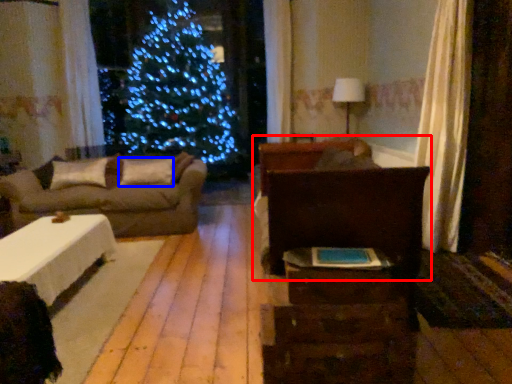
Question: Which of the following is the closest to the observer, bed (highlighted by a red box) or pillow (highlighted by a blue box)?

Choices:
 (A) bed
 (B) pillow

Answer: (A)